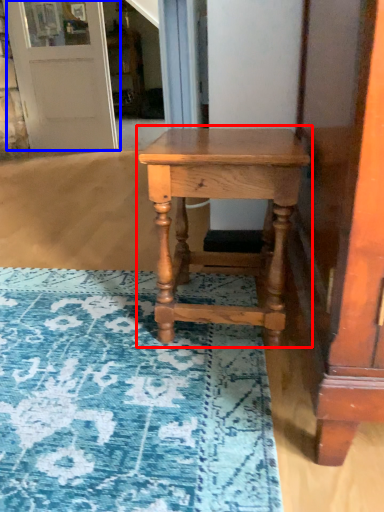
Question: Which object is further to the camera taking this photo, table (highlighted by a red box) or door (highlighted by a blue box)?

Choices:
 (A) table
 (B) door

Answer: (B)